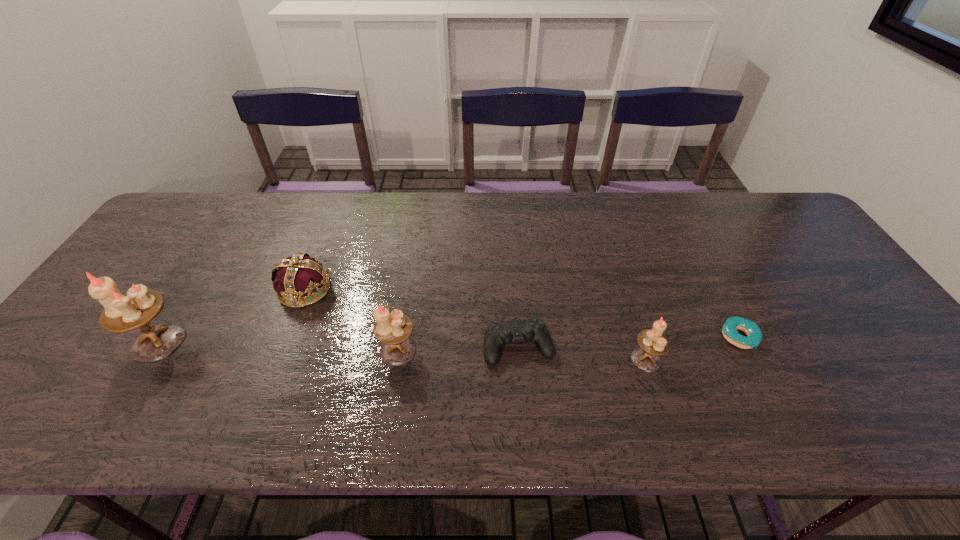
The image size is (960, 540). I want to click on object that is at the near left corner, so click(x=139, y=306).

Where is `free location at the far edge`? free location at the far edge is located at coordinates (285, 208).

The width and height of the screenshot is (960, 540). Identify the location of vacant space at the near edge. (699, 362).

The width and height of the screenshot is (960, 540). I want to click on vacant space at the left edge of the desktop, so click(x=106, y=339).

The width and height of the screenshot is (960, 540). I want to click on vacant region at the right edge of the desktop, so click(x=795, y=258).

Locate an element on the screen. The width and height of the screenshot is (960, 540). free point at the near left corner is located at coordinates (103, 379).

Identify the location of free area in between the shortest candle holder and the rightmost object. The image size is (960, 540). (692, 348).

I want to click on free spot between the third tallest object and the rightmost object, so click(x=692, y=348).

The width and height of the screenshot is (960, 540). In order to click on free space between the rightmost candle holder and the crown in this screenshot , I will do `click(475, 325)`.

Where is `free space between the fifth object from right to left and the third object from right to left`? Image resolution: width=960 pixels, height=540 pixels. free space between the fifth object from right to left and the third object from right to left is located at coordinates (412, 319).